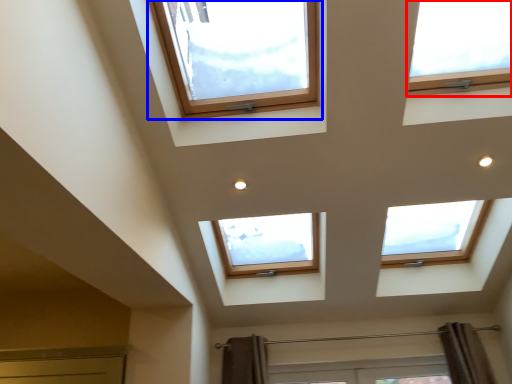
Question: Which point is closer to the camera, window (highlighted by a red box) or window (highlighted by a blue box)?

Choices:
 (A) window
 (B) window

Answer: (B)